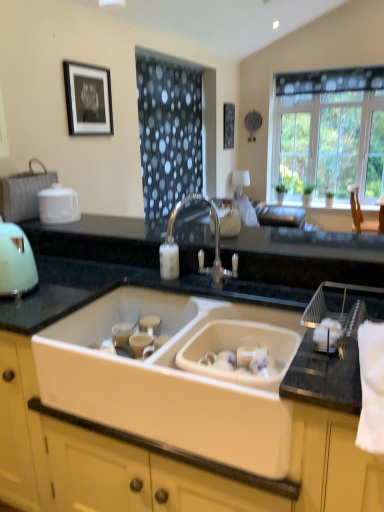
Where is `clear glass window at upper right`? The height and width of the screenshot is (512, 384). clear glass window at upper right is located at coordinates (329, 132).

Where is `black matte picture frame at upper center, arranged as the first picture frame when viewed from the back`? This screenshot has height=512, width=384. black matte picture frame at upper center, arranged as the first picture frame when viewed from the back is located at coordinates (228, 125).

Based on the photo, between white ceramic sink at center and black matte picture frame at upper center, the 2th picture frame in the bottom-to-top sequence, which one is positioned behind?

black matte picture frame at upper center, the 2th picture frame in the bottom-to-top sequence, is more distant.

What are the coordinates of `the 2nd picture frame behind the white ceramic sink at center` in the screenshot? It's located at (228, 125).

How different are the orientations of white ceramic sink at center and black matte picture frame at upper center, placed as the 2th picture frame when sorted from left to right, in degrees?

The angle between the facing direction of white ceramic sink at center and the facing direction of black matte picture frame at upper center, placed as the 2th picture frame when sorted from left to right, is 90.5 degrees.

Which point is more forward, (245, 414) or (231, 122)?

The point (245, 414) is more forward.

Measure the distance from matte green kettle at left to clear glass window at upper right.

They are 4.66 meters apart.

From a real-world perspective, is matte green kettle at left on clear glass window at upper right?

No, from a real-world perspective, matte green kettle at left is not above clear glass window at upper right.

Choose the correct answer: Is matte green kettle at left inside clear glass window at upper right or outside it?

matte green kettle at left is not enclosed by clear glass window at upper right.

Is matte green kettle at left aimed at clear glass window at upper right?

No.

Measure the distance between matte green kettle at left and black matte picture frame at upper center, marked as the 1th picture frame in a right-to-left arrangement.

matte green kettle at left and black matte picture frame at upper center, marked as the 1th picture frame in a right-to-left arrangement, are 13.06 feet apart.

Is matte green kettle at left not near black matte picture frame at upper center, marked as the 1th picture frame in a right-to-left arrangement?

That's right, there is a large distance between matte green kettle at left and black matte picture frame at upper center, marked as the 1th picture frame in a right-to-left arrangement.

Which point is more distant from viewer, (4, 285) or (230, 136)?

Positioned behind is point (230, 136).

Considering the sizes of objects matte green kettle at left and black matte picture frame at upper center, arranged as the 2th picture frame when viewed from the front, in the image provided, who is shorter, matte green kettle at left or black matte picture frame at upper center, arranged as the 2th picture frame when viewed from the front,?

With less height is matte green kettle at left.

Does satin nickel faucet at center contain black matte picture frame at upper center, the 2th picture frame in the bottom-to-top sequence?

No, satin nickel faucet at center does not contain black matte picture frame at upper center, the 2th picture frame in the bottom-to-top sequence.

How many degrees apart are the facing directions of satin nickel faucet at center and black matte picture frame at upper center, marked as the 1th picture frame in a right-to-left arrangement?

They differ by 87.7 degrees in their facing directions.

From their relative heights in the image, would you say satin nickel faucet at center is taller or shorter than black matte picture frame at upper center, the 2th picture frame in the bottom-to-top sequence?

In the image, satin nickel faucet at center appears to be shorter than black matte picture frame at upper center, the 2th picture frame in the bottom-to-top sequence.

Between satin nickel faucet at center and black matte picture frame at upper center, placed as the 2th picture frame when sorted from left to right, which one appears on the left side from the viewer's perspective?

Positioned to the left is satin nickel faucet at center.

Does clear glass window at upper right come behind satin nickel faucet at center?

Yes.

Can you see clear glass window at upper right touching satin nickel faucet at center?

No, clear glass window at upper right is not with satin nickel faucet at center.

From the image's perspective, between clear glass window at upper right and satin nickel faucet at center, which one is located above?

clear glass window at upper right.

Which is more to the left, clear glass window at upper right or satin nickel faucet at center?

satin nickel faucet at center.

Is satin nickel faucet at center completely or partially outside of white ceramic sink at center?

That's correct, satin nickel faucet at center is outside of white ceramic sink at center.

Looking at their sizes, would you say satin nickel faucet at center is wider or thinner than white ceramic sink at center?

Clearly, satin nickel faucet at center has less width compared to white ceramic sink at center.

Is satin nickel faucet at center aimed at white ceramic sink at center?

No, satin nickel faucet at center is not facing towards white ceramic sink at center.

Is satin nickel faucet at center bigger or smaller than white ceramic sink at center?

Considering their sizes, satin nickel faucet at center takes up less space than white ceramic sink at center.

Can you confirm if black matte picture frame at upper center, arranged as the 2th picture frame when viewed from the front, is taller than black matte picture frame at upper left, the second picture frame when ordered from right to left?

Yes.

Which object is thinner, black matte picture frame at upper center, marked as the 1th picture frame in a right-to-left arrangement, or black matte picture frame at upper left, the first picture frame from the bottom?

Thinner between the two is black matte picture frame at upper left, the first picture frame from the bottom.

Based on the photo, from the image's perspective, which is below, black matte picture frame at upper center, the 2th picture frame in the bottom-to-top sequence, or black matte picture frame at upper left, arranged as the 1th picture frame when viewed from the front?

black matte picture frame at upper left, arranged as the 1th picture frame when viewed from the front, is shown below in the image.

Considering the positions of objects black matte picture frame at upper center, marked as the 1th picture frame in a right-to-left arrangement, and black matte picture frame at upper left, the first picture frame from the bottom, in the image provided, who is more to the left, black matte picture frame at upper center, marked as the 1th picture frame in a right-to-left arrangement, or black matte picture frame at upper left, the first picture frame from the bottom,?

black matte picture frame at upper left, the first picture frame from the bottom, is more to the left.

At what (x,y) coordinates should I click in order to perform the action: click on sink below the black matte picture frame at upper center, arranged as the 2th picture frame when viewed from the front (from a real-world perspective). Please return your answer as a coordinate pair (x, y). Looking at the image, I should click on (174, 381).

Locate an element on the screen. appliance in front of the clear glass window at upper right is located at coordinates (16, 261).

When comparing their distances from black matte picture frame at upper center, marked as the 1th picture frame in a right-to-left arrangement, does matte green kettle at left or black matte picture frame at upper left, arranged as the first picture frame when viewed from the left, seem further?

The object further to black matte picture frame at upper center, marked as the 1th picture frame in a right-to-left arrangement, is matte green kettle at left.

When comparing their distances from satin nickel faucet at center, does black matte picture frame at upper left, the first picture frame from the bottom, or clear glass window at upper right seem closer?

Among the two, black matte picture frame at upper left, the first picture frame from the bottom, is located nearer to satin nickel faucet at center.

Based on their spatial positions, is black matte picture frame at upper center, the 2th picture frame in the bottom-to-top sequence, or matte green kettle at left further from black matte picture frame at upper left, arranged as the first picture frame when viewed from the left?

black matte picture frame at upper center, the 2th picture frame in the bottom-to-top sequence.

Looking at the image, which one is located further to black matte picture frame at upper left, arranged as the 1th picture frame when viewed from the front, clear glass window at upper right or matte green kettle at left?

The object further to black matte picture frame at upper left, arranged as the 1th picture frame when viewed from the front, is clear glass window at upper right.

When comparing their distances from black matte picture frame at upper center, marked as the 1th picture frame in a right-to-left arrangement, does satin nickel faucet at center or black matte picture frame at upper left, the first picture frame from the bottom, seem further?

satin nickel faucet at center is further to black matte picture frame at upper center, marked as the 1th picture frame in a right-to-left arrangement.

Which object lies nearer to the anchor point matte green kettle at left, black matte picture frame at upper left, the first picture frame from the bottom, or black matte picture frame at upper center, the 2th picture frame in the bottom-to-top sequence?

black matte picture frame at upper left, the first picture frame from the bottom, lies closer to matte green kettle at left than the other object.

When comparing their distances from matte green kettle at left, does black matte picture frame at upper center, the 1th picture frame in the top-to-bottom sequence, or satin nickel faucet at center seem closer?

Based on the image, satin nickel faucet at center appears to be nearer to matte green kettle at left.

Looking at the image, which one is located further to white ceramic sink at center, clear glass window at upper right or black matte picture frame at upper left, the second picture frame when ordered from right to left?

Based on the image, clear glass window at upper right appears to be further to white ceramic sink at center.

This screenshot has width=384, height=512. Find the location of `tap between white ceramic sink at center and clear glass window at upper right in the front-back direction`. tap between white ceramic sink at center and clear glass window at upper right in the front-back direction is located at coordinates (198, 252).

Where is `appliance located between satin nickel faucet at center and black matte picture frame at upper left, arranged as the 1th picture frame when viewed from the front, in the depth direction`? The height and width of the screenshot is (512, 384). appliance located between satin nickel faucet at center and black matte picture frame at upper left, arranged as the 1th picture frame when viewed from the front, in the depth direction is located at coordinates (16, 261).

The height and width of the screenshot is (512, 384). I want to click on appliance located between satin nickel faucet at center and clear glass window at upper right in the depth direction, so click(16, 261).

Identify the location of picture frame between satin nickel faucet at center and clear glass window at upper right from front to back. (88, 99).